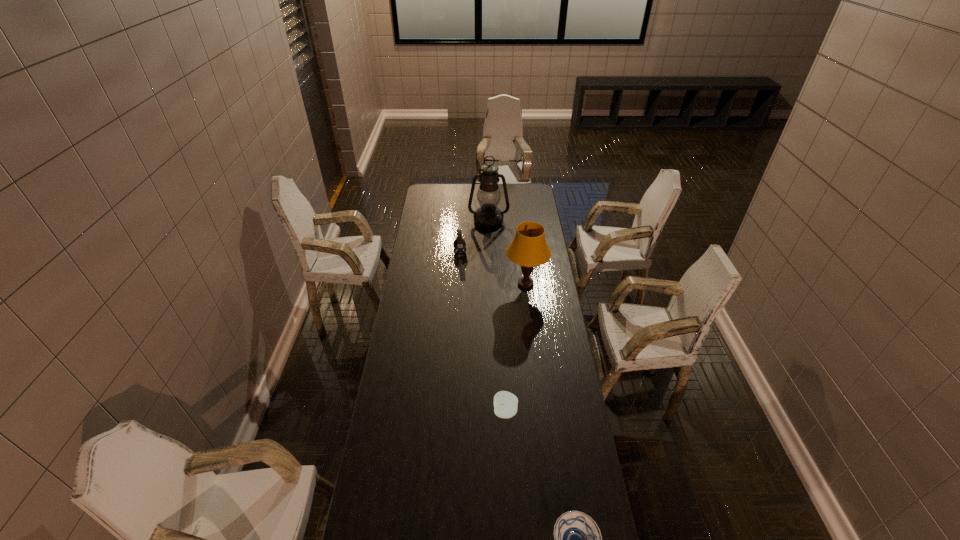
You are a GUI agent. You are given a task and a screenshot of the screen. Output one action in this format:
    pyautogui.click(x=<x>, y=<y>)
    Task: Click on the oil lamp
    
    Given the screenshot: What is the action you would take?
    (x=488, y=215)

In order to click on the farthest object in this screenshot , I will do click(x=488, y=215).

Identify the location of the fourth shortest object. Image resolution: width=960 pixels, height=540 pixels. (529, 249).

The width and height of the screenshot is (960, 540). I want to click on lampshade, so click(x=529, y=249).

Locate an element on the screen. headset is located at coordinates (459, 244).

This screenshot has width=960, height=540. I want to click on the leftmost object, so click(459, 244).

Identify the location of apple. (505, 403).

Locate an element on the screen. Image resolution: width=960 pixels, height=540 pixels. the fourth tallest object is located at coordinates (505, 403).

Locate an element on the screen. The image size is (960, 540). vacant space positioned on the front of the farthest object is located at coordinates (489, 242).

Where is `free space located on the front of the third farthest object`? The height and width of the screenshot is (540, 960). free space located on the front of the third farthest object is located at coordinates (534, 353).